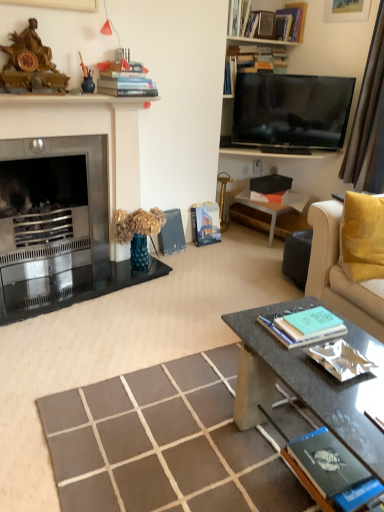
Question: Is the position of soft yellow fabric couch at right less distant than that of hardcover book at center, acting as the fifth book starting from the bottom?

Choices:
 (A) no
 (B) yes

Answer: (B)

Question: Is soft yellow fabric couch at right facing away from hardcover book at center, the fifth book viewed from the top?

Choices:
 (A) no
 (B) yes

Answer: (B)

Question: Does soft yellow fabric couch at right have a greater width compared to hardcover book at center, acting as the fifth book starting from the bottom?

Choices:
 (A) no
 (B) yes

Answer: (B)

Question: Does soft yellow fabric couch at right turn towards hardcover book at center, the fifth book viewed from the top?

Choices:
 (A) no
 (B) yes

Answer: (A)

Question: From a real-world perspective, is soft yellow fabric couch at right positioned under hardcover book at center, acting as the fifth book starting from the bottom, based on gravity?

Choices:
 (A) no
 (B) yes

Answer: (A)

Question: In the image, is hardcover book at center, the 4th book when ordered from bottom to top, on the left side or the right side of hardcover book at upper center, the ninth book ordered from the bottom?

Choices:
 (A) left
 (B) right

Answer: (A)

Question: Choose the correct answer: Is hardcover book at center, which is the 6th book from top to bottom, inside hardcover book at upper center, which ranks as the 1th book in top-to-bottom order, or outside it?

Choices:
 (A) inside
 (B) outside

Answer: (B)

Question: From a real-world perspective, is hardcover book at center, which is the 6th book from top to bottom, positioned above or below hardcover book at upper center, the ninth book ordered from the bottom?

Choices:
 (A) above
 (B) below

Answer: (B)

Question: From the image's perspective, relative to hardcover book at upper center, which ranks as the 1th book in top-to-bottom order, is hardcover book at center, which is the 6th book from top to bottom, above or below?

Choices:
 (A) below
 (B) above

Answer: (A)

Question: In terms of size, does dark gray concrete coffee table at lower right appear bigger or smaller than metallic fireplace at left?

Choices:
 (A) big
 (B) small

Answer: (B)

Question: Is dark gray concrete coffee table at lower right in front of or behind metallic fireplace at left in the image?

Choices:
 (A) front
 (B) behind

Answer: (A)

Question: Would you say dark gray concrete coffee table at lower right is to the left or to the right of metallic fireplace at left in the picture?

Choices:
 (A) right
 (B) left

Answer: (A)

Question: Considering the positions of dark gray concrete coffee table at lower right and metallic fireplace at left in the image, is dark gray concrete coffee table at lower right taller or shorter than metallic fireplace at left?

Choices:
 (A) short
 (B) tall

Answer: (A)

Question: Choose the correct answer: Is flat screen tv at upper right inside hardcover books at upper center, marked as the eighth book in a bottom-to-top arrangement, or outside it?

Choices:
 (A) outside
 (B) inside

Answer: (A)

Question: Is point [248, 140] positioned closer to the camera than point [236, 49]?

Choices:
 (A) closer
 (B) farther

Answer: (B)